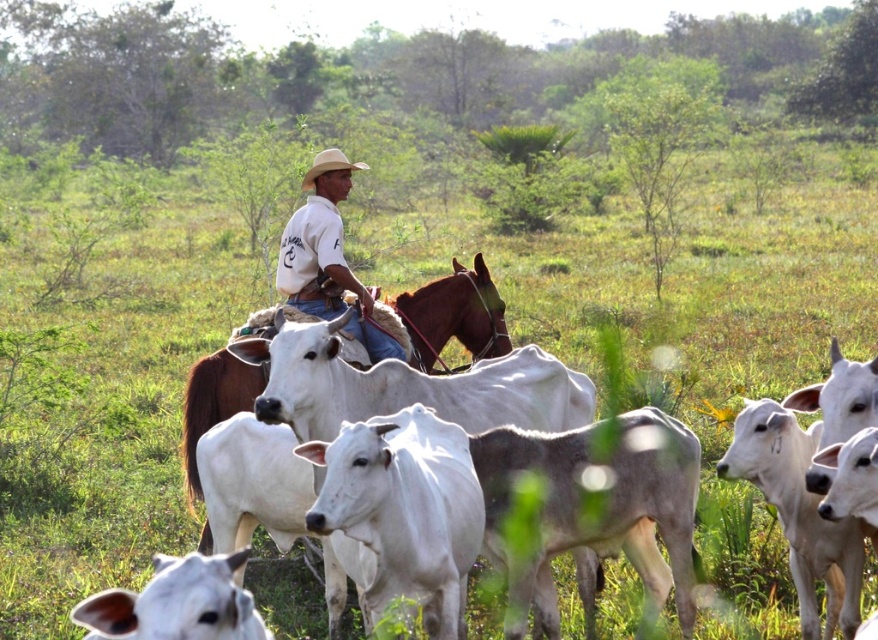
Can you confirm if brown leather horse at center is wider than white cotton shirt at center?

No.

Is point (265, 333) positioned before point (330, 161)?

Yes, point (265, 333) is closer to viewer.

Image resolution: width=878 pixels, height=640 pixels. What are the coordinates of `brown leather horse at center` in the screenshot? It's located at (454, 316).

Is gray smooth cow at center thinner than brown leather horse at center?

No, gray smooth cow at center is not thinner than brown leather horse at center.

Is gray smooth cow at center behind brown leather horse at center?

That is False.

Who is more distant from viewer, (545, 588) or (255, 378)?

Positioned behind is point (255, 378).

Find the location of a particular element. The height and width of the screenshot is (640, 878). gray smooth cow at center is located at coordinates (595, 508).

Is point (615, 492) more distant than point (322, 172)?

No, (615, 492) is in front of (322, 172).

Is gray smooth cow at center positioned at the back of light brown straw cowboy hat at center?

No, it is in front of light brown straw cowboy hat at center.

What are the coordinates of `gray smooth cow at center` in the screenshot? It's located at (595, 508).

Locate an element on the screen. The height and width of the screenshot is (640, 878). gray smooth cow at center is located at coordinates (595, 508).